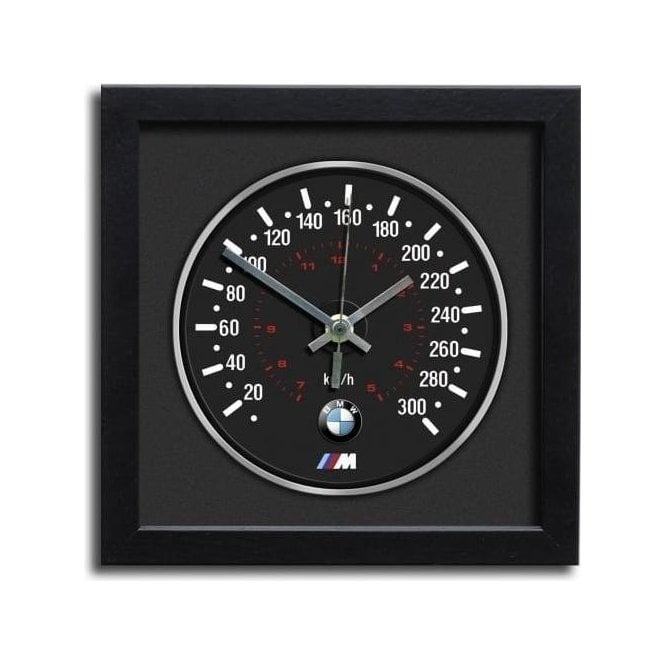
You are a GUI agent. You are given a task and a screenshot of the screen. Output one action in this format:
    pyautogui.click(x=<x>, y=<y>)
    Task: Click on the clock
    
    Given the screenshot: What is the action you would take?
    pyautogui.click(x=298, y=299)